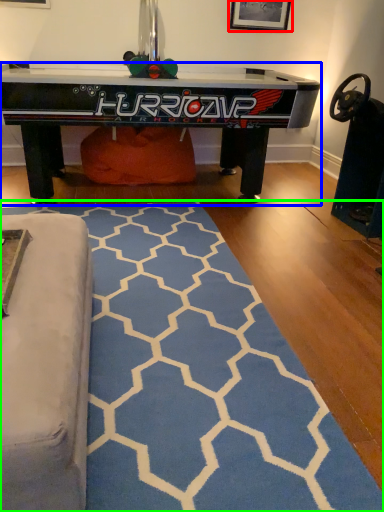
Question: Based on their relative distances, which object is nearer to picture frame (highlighted by a red box)? Choose from table (highlighted by a blue box) and mat (highlighted by a green box).

Choices:
 (A) table
 (B) mat

Answer: (A)